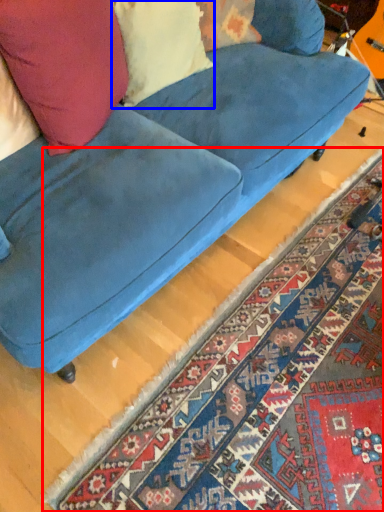
Question: Which of the following is the closest to the observer, mat (highlighted by a red box) or pillow (highlighted by a blue box)?

Choices:
 (A) mat
 (B) pillow

Answer: (A)